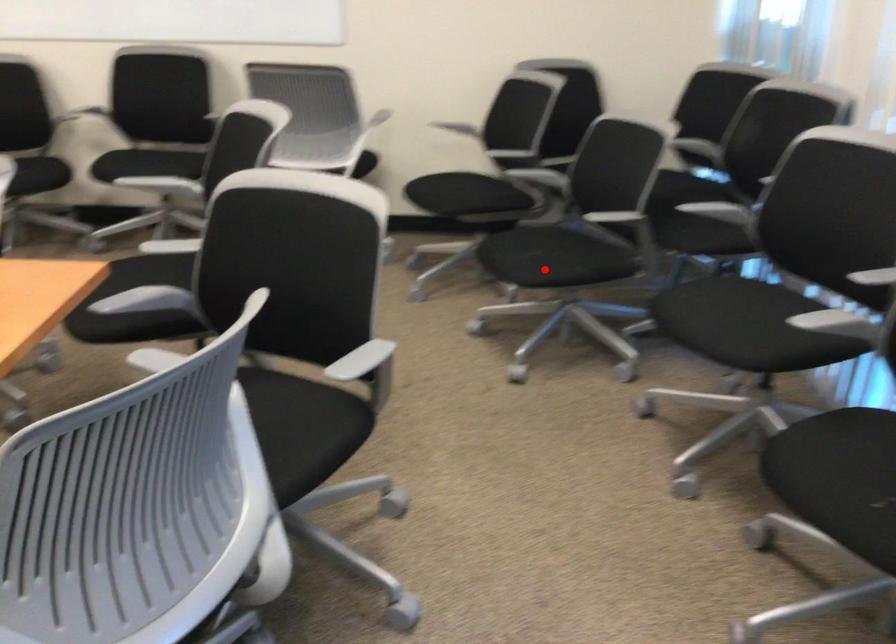
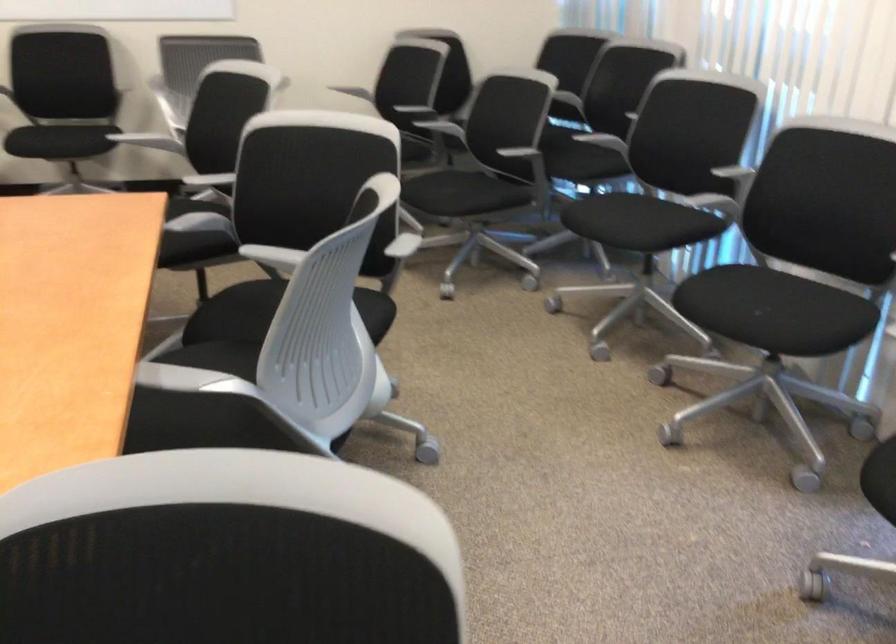
Question: I am providing you with two images of the same scene from different viewpoints. Given a red point in image1, look at the same physical point in image2. Is it:

Choices:
 (A) Closer to the viewpoint
 (B) Farther from the viewpoint

Answer: (B)